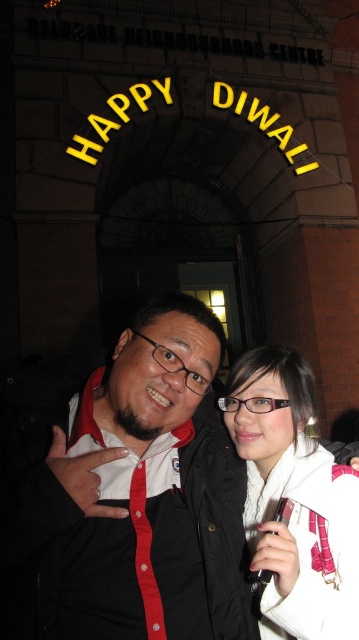
Question: Which point appears farthest from the camera in this image?

Choices:
 (A) coord(327,624)
 (B) coord(12,588)

Answer: (B)

Question: Which point is farther to the camera?

Choices:
 (A) (169, 602)
 (B) (337, 592)

Answer: (A)

Question: Does matte black shirt at center have a greater width compared to white soft scarf at center?

Choices:
 (A) no
 (B) yes

Answer: (A)

Question: Is matte black shirt at center to the left of white soft scarf at center from the viewer's perspective?

Choices:
 (A) no
 (B) yes

Answer: (B)

Question: Does matte black shirt at center appear on the right side of white soft scarf at center?

Choices:
 (A) yes
 (B) no

Answer: (B)